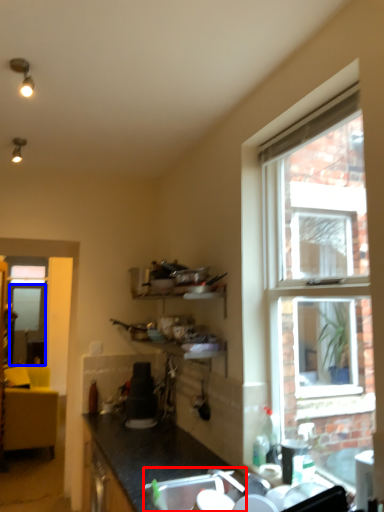
Question: Which point is closer to the camera, sink (highlighted by a red box) or screen door (highlighted by a blue box)?

Choices:
 (A) sink
 (B) screen door

Answer: (A)